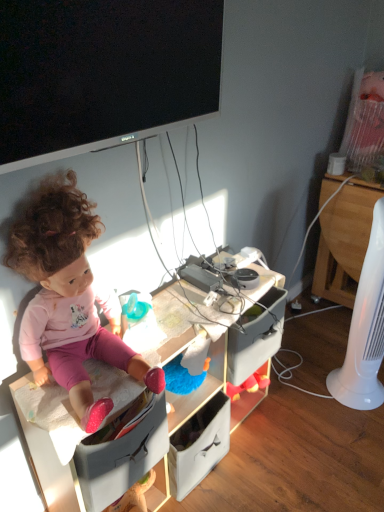
Question: Considering the positions of wooden at right and white plastic fan at right in the image, is wooden at right bigger or smaller than white plastic fan at right?

Choices:
 (A) small
 (B) big

Answer: (B)

Question: In the image, is wooden at right positioned in front of or behind white plastic fan at right?

Choices:
 (A) behind
 (B) front

Answer: (A)

Question: Estimate the real-world distances between objects in this image. Which object is farther from the pink fabric doll at left?

Choices:
 (A) matte plastic desk at center
 (B) black glossy flat-screen tv at upper center
 (C) wooden at right
 (D) white plastic fan at right

Answer: (C)

Question: Estimate the real-world distances between objects in this image. Which object is closer to the wooden at right?

Choices:
 (A) matte plastic desk at center
 (B) white plastic fan at right
 (C) pink fabric doll at left
 (D) black glossy flat-screen tv at upper center

Answer: (B)